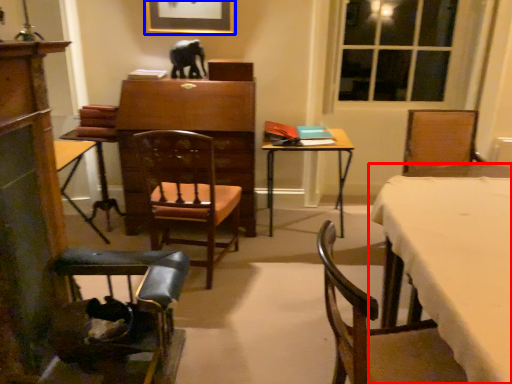
Question: Which point is further to the camera, desk (highlighted by a red box) or picture frame (highlighted by a blue box)?

Choices:
 (A) desk
 (B) picture frame

Answer: (B)